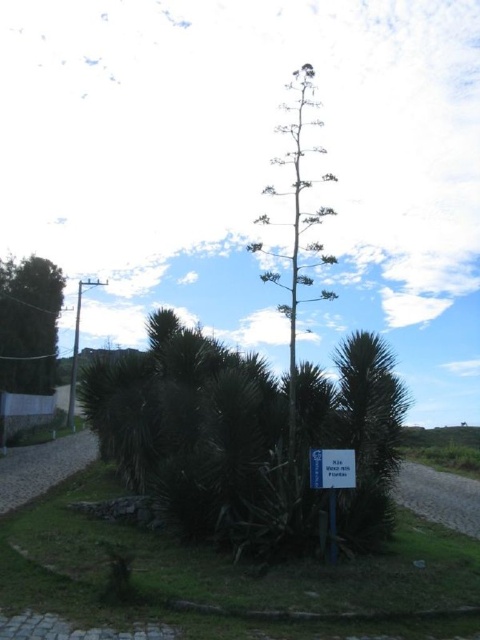
Who is shorter, dark green leafy tree at left or white plastic sign at center?

With less height is white plastic sign at center.

Does dark green leafy tree at left have a lesser height compared to white plastic sign at center?

In fact, dark green leafy tree at left may be taller than white plastic sign at center.

The width and height of the screenshot is (480, 640). I want to click on dark green leafy tree at left, so click(28, 323).

Who is more distant from viewer, (41, 301) or (313, 486)?

The point (41, 301) is behind.

Can you confirm if dark green leafy tree at left is positioned above blue plastic sign at center?

Yes, dark green leafy tree at left is above blue plastic sign at center.

Is point (2, 291) positioned in front of point (336, 465)?

No, (2, 291) is behind (336, 465).

Locate an element on the screen. The width and height of the screenshot is (480, 640). dark green leafy tree at left is located at coordinates (28, 323).

Is green spiky palm tree at center positioned in front of blue plastic sign at center?

No, green spiky palm tree at center is behind blue plastic sign at center.

Describe the element at coordinates (368, 435) in the screenshot. The image size is (480, 640). I see `green spiky palm tree at center` at that location.

Locate an element on the screen. This screenshot has width=480, height=640. green spiky palm tree at center is located at coordinates (368, 435).